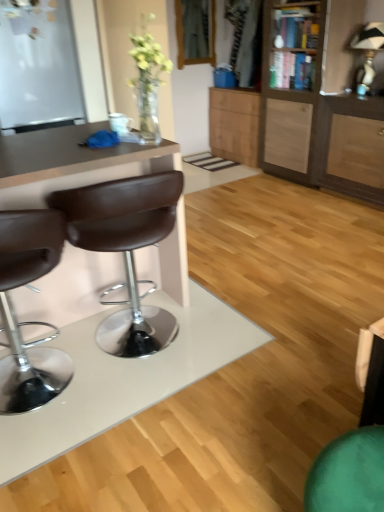
Find the location of `vacant region in front of brown leather stool at left, which appears as the 2th chair when viewed from the left`. vacant region in front of brown leather stool at left, which appears as the 2th chair when viewed from the left is located at coordinates (147, 414).